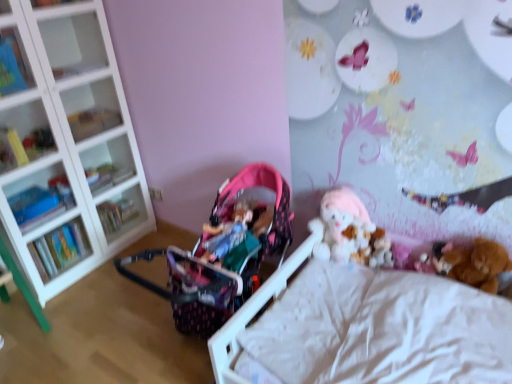
Where is `vacant space positioned to the left of pink fabric baby carriage at center`? The height and width of the screenshot is (384, 512). vacant space positioned to the left of pink fabric baby carriage at center is located at coordinates (120, 332).